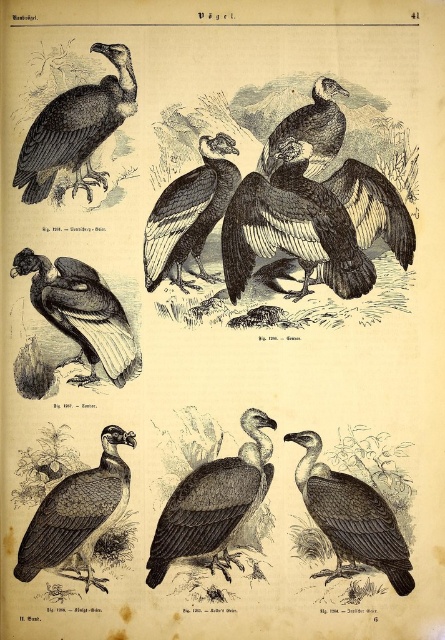
Question: Is dark gray feathers at upper left to the left of dark gray feathers at center from the viewer's perspective?

Choices:
 (A) yes
 (B) no

Answer: (A)

Question: Does gray feathered vulture at center appear on the left side of matte black vulture at center?

Choices:
 (A) yes
 (B) no

Answer: (B)

Question: Among these points, which one is farthest from the camera?

Choices:
 (A) (257, 460)
 (B) (233, 152)
 (C) (335, 116)
 (D) (343, 499)

Answer: (C)

Question: Which is nearer to the gray feathered vulture at center?

Choices:
 (A) dark gray feathered vulture at center
 (B) matte black vulture at center

Answer: (A)

Question: Which point is farther from the camera taking this photo?

Choices:
 (A) (17, 570)
 (B) (350, 234)

Answer: (A)

Question: Is dark gray feathers at upper left wider than matte black vulture at center?

Choices:
 (A) yes
 (B) no

Answer: (B)